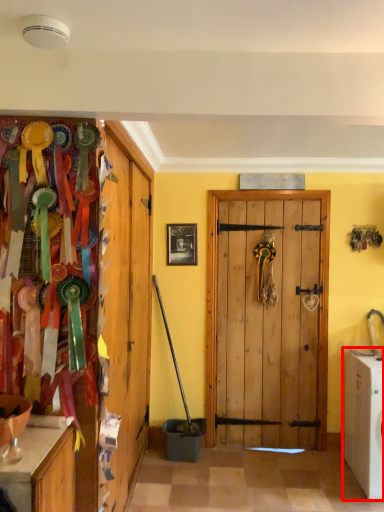
Question: Considering the relative positions of washing machine (annotated by the red box) and picture frame in the image provided, where is washing machine (annotated by the red box) located with respect to the staircase?

Choices:
 (A) right
 (B) left

Answer: (A)